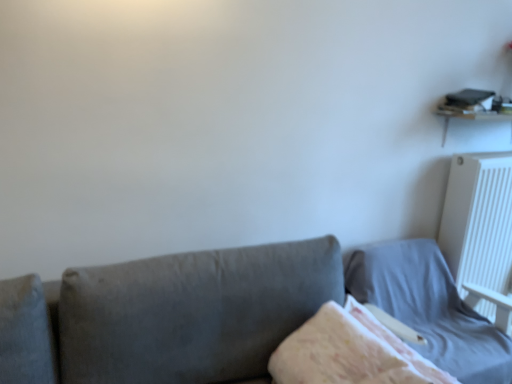
Question: Does light gray fabric bed at lower right have a smaller size compared to white plastic radiator at upper right?

Choices:
 (A) yes
 (B) no

Answer: (B)

Question: From a real-world perspective, is light gray fabric bed at lower right on white plastic radiator at upper right?

Choices:
 (A) yes
 (B) no

Answer: (B)

Question: Can you see light gray fabric bed at lower right touching white plastic radiator at upper right?

Choices:
 (A) no
 (B) yes

Answer: (A)

Question: Are light gray fabric bed at lower right and white plastic radiator at upper right far apart?

Choices:
 (A) yes
 (B) no

Answer: (B)

Question: Is light gray fabric bed at lower right oriented towards white plastic radiator at upper right?

Choices:
 (A) no
 (B) yes

Answer: (A)

Question: Is point (442, 326) positioned closer to the camera than point (404, 344)?

Choices:
 (A) closer
 (B) farther

Answer: (B)

Question: Which is correct: light gray fabric bed at lower right is inside fluffy white blanket at center, or outside of it?

Choices:
 (A) inside
 (B) outside

Answer: (B)

Question: In the image, is light gray fabric bed at lower right positioned in front of or behind fluffy white blanket at center?

Choices:
 (A) behind
 (B) front

Answer: (A)

Question: Is light gray fabric bed at lower right wider or thinner than fluffy white blanket at center?

Choices:
 (A) thin
 (B) wide

Answer: (B)

Question: From a real-world perspective, is fluffy white blanket at center positioned above or below white plastic radiator at upper right?

Choices:
 (A) below
 (B) above

Answer: (A)

Question: In terms of height, does fluffy white blanket at center look taller or shorter compared to white plastic radiator at upper right?

Choices:
 (A) tall
 (B) short

Answer: (B)

Question: Looking at their shapes, would you say fluffy white blanket at center is wider or thinner than white plastic radiator at upper right?

Choices:
 (A) wide
 (B) thin

Answer: (A)

Question: Is point (305, 362) positioned closer to the camera than point (504, 299)?

Choices:
 (A) closer
 (B) farther

Answer: (A)

Question: Considering the positions of white plastic radiator at upper right and fluffy white blanket at center in the image, is white plastic radiator at upper right bigger or smaller than fluffy white blanket at center?

Choices:
 (A) big
 (B) small

Answer: (A)

Question: Is white plastic radiator at upper right inside or outside of fluffy white blanket at center?

Choices:
 (A) inside
 (B) outside

Answer: (B)